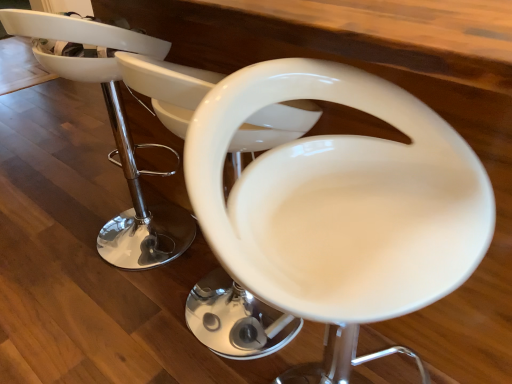
Find the location of `free space in front of white glossy bar stool at center`. free space in front of white glossy bar stool at center is located at coordinates (95, 319).